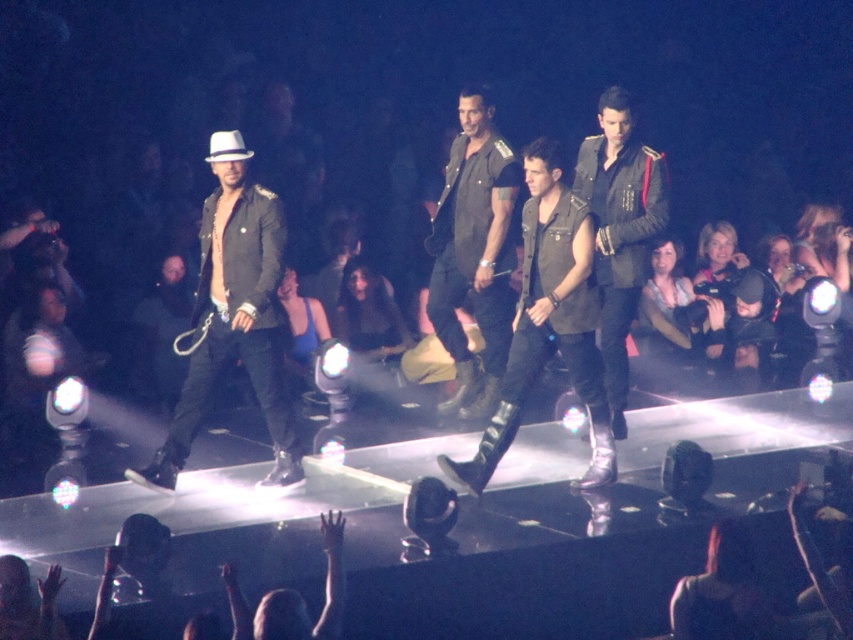
Question: Which point is closer to the camera?

Choices:
 (A) tap(659, 209)
 (B) tap(488, 410)
 (C) tap(525, 364)

Answer: (C)

Question: In this image, where is matte black boots at center located relative to leather jacket at center?

Choices:
 (A) below
 (B) above

Answer: (A)

Question: Considering the relative positions of matte black jacket at left and matte black boots at center in the image provided, where is matte black jacket at left located with respect to matte black boots at center?

Choices:
 (A) above
 (B) below

Answer: (A)

Question: Where is matte black jacket at left located in relation to matte black boots at center in the image?

Choices:
 (A) below
 (B) above

Answer: (B)

Question: Which point is farther to the camera?

Choices:
 (A) dark green military jacket at center
 (B) matte black boots at center

Answer: (A)

Question: Which object appears closest to the camera in this image?

Choices:
 (A) dark green military jacket at center
 (B) matte black jacket at left
 (C) leather jacket at center
 (D) matte black boots at center

Answer: (D)